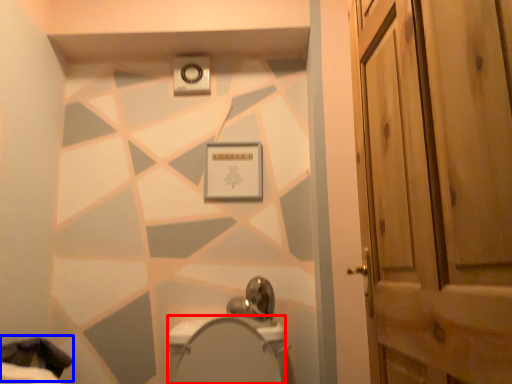
Question: Which object appears closest to the camera in this image, bidet (highlighted by a red box) or laundry (highlighted by a blue box)?

Choices:
 (A) bidet
 (B) laundry

Answer: (A)